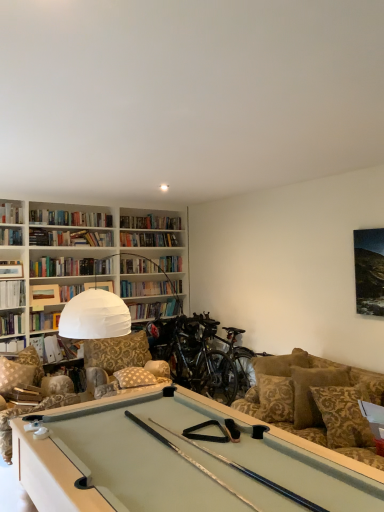
Question: Does camouflage fabric swivel chair at lower left have a lesser width compared to shiny black mountain bike at center, placed as the first mountain bike when sorted from left to right?

Choices:
 (A) no
 (B) yes

Answer: (A)

Question: Is camouflage fabric swivel chair at lower left to the right of shiny black mountain bike at center, positioned as the second mountain bike in right-to-left order, from the viewer's perspective?

Choices:
 (A) yes
 (B) no

Answer: (B)

Question: Would you consider camouflage fabric swivel chair at lower left to be distant from shiny black mountain bike at center, placed as the first mountain bike when sorted from left to right?

Choices:
 (A) yes
 (B) no

Answer: (A)

Question: Is camouflage fabric swivel chair at lower left in contact with shiny black mountain bike at center, positioned as the second mountain bike in right-to-left order?

Choices:
 (A) no
 (B) yes

Answer: (A)

Question: Considering the relative positions of camouflage fabric swivel chair at lower left and shiny black mountain bike at center, positioned as the second mountain bike in right-to-left order, in the image provided, is camouflage fabric swivel chair at lower left in front of shiny black mountain bike at center, positioned as the second mountain bike in right-to-left order,?

Choices:
 (A) yes
 (B) no

Answer: (A)

Question: From the image's perspective, is matte white book at upper left, placed as the fourth book when sorted from top to bottom, positioned above or below silver metallic mountain bike at center, the second mountain bike viewed from the left?

Choices:
 (A) below
 (B) above

Answer: (B)

Question: Looking at the image, does matte white book at upper left, placed as the fourth book when sorted from top to bottom, seem bigger or smaller compared to silver metallic mountain bike at center, which appears as the 1th mountain bike when viewed from the right?

Choices:
 (A) small
 (B) big

Answer: (A)

Question: Considering the positions of matte white book at upper left, positioned as the 2th book in bottom-to-top order, and silver metallic mountain bike at center, the second mountain bike viewed from the left, in the image, is matte white book at upper left, positioned as the 2th book in bottom-to-top order, wider or thinner than silver metallic mountain bike at center, the second mountain bike viewed from the left,?

Choices:
 (A) wide
 (B) thin

Answer: (B)

Question: Relative to silver metallic mountain bike at center, which appears as the 1th mountain bike when viewed from the right, is matte white book at upper left, placed as the fourth book when sorted from top to bottom, in front or behind?

Choices:
 (A) front
 (B) behind

Answer: (B)

Question: Considering the positions of camouflage fabric swivel chair at lower left and hardcover book at left, placed as the 3th book when sorted from top to bottom, in the image, is camouflage fabric swivel chair at lower left wider or thinner than hardcover book at left, placed as the 3th book when sorted from top to bottom,?

Choices:
 (A) thin
 (B) wide

Answer: (B)

Question: Is camouflage fabric swivel chair at lower left in front of or behind hardcover book at left, which ranks as the 3th book in bottom-to-top order, in the image?

Choices:
 (A) behind
 (B) front

Answer: (B)

Question: From their relative heights in the image, would you say camouflage fabric swivel chair at lower left is taller or shorter than hardcover book at left, which ranks as the 3th book in bottom-to-top order?

Choices:
 (A) short
 (B) tall

Answer: (B)

Question: Is camouflage fabric swivel chair at lower left inside or outside of hardcover book at left, which ranks as the 3th book in bottom-to-top order?

Choices:
 (A) inside
 (B) outside

Answer: (B)

Question: Is patterned fabric pillow at center, the first pillow when ordered from left to right, bigger or smaller than hardcover book at upper left, the second book viewed from the top?

Choices:
 (A) big
 (B) small

Answer: (A)

Question: From the image's perspective, is patterned fabric pillow at center, the first pillow when ordered from left to right, located above or below hardcover book at upper left, the second book viewed from the top?

Choices:
 (A) above
 (B) below

Answer: (B)